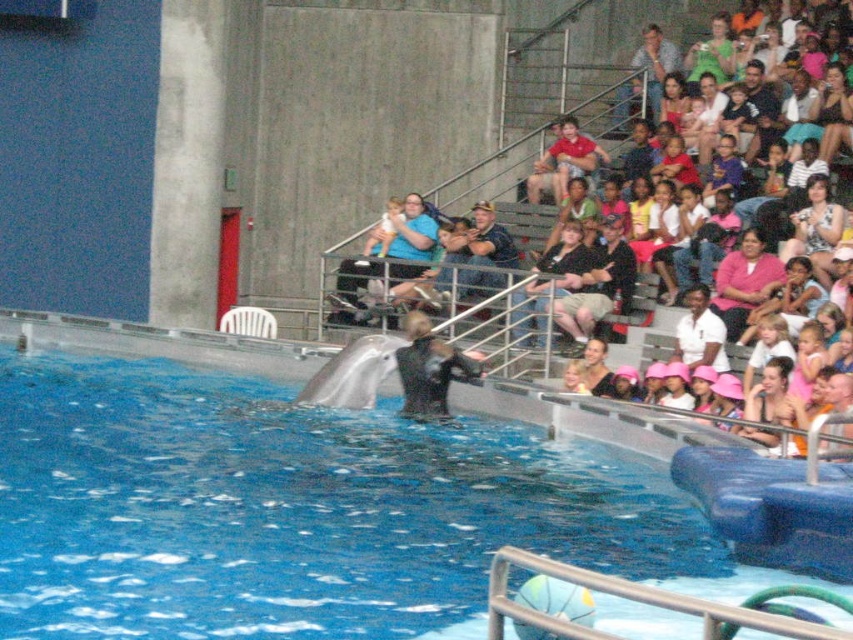
From the picture: Can you confirm if matte black dolphin at center is smaller than pink matte shirt at upper right?

No, matte black dolphin at center is not smaller than pink matte shirt at upper right.

Is matte black dolphin at center taller than pink matte shirt at upper right?

Correct, matte black dolphin at center is much taller as pink matte shirt at upper right.

Is point (601, 131) farther from viewer compared to point (747, 298)?

That is True.

Where is `matte black dolphin at center`? Image resolution: width=853 pixels, height=640 pixels. matte black dolphin at center is located at coordinates (605, 422).

Is blue rubber swimming pool at center below matte black dolphin at center?

Yes, blue rubber swimming pool at center is below matte black dolphin at center.

Is point (361, 428) more distant than point (660, 458)?

Yes, it is.

Does point (384, 472) come behind point (691, 422)?

Yes, point (384, 472) is farther from viewer.

The width and height of the screenshot is (853, 640). I want to click on blue rubber swimming pool at center, so click(294, 509).

Is white smooth dolphin at center above white cotton shirt at upper right?

Actually, white smooth dolphin at center is below white cotton shirt at upper right.

Who is positioned more to the left, white smooth dolphin at center or white cotton shirt at upper right?

white smooth dolphin at center is more to the left.

Which is in front, point (354, 392) or point (698, 339)?

Point (354, 392) is in front.

You are a GUI agent. You are given a task and a screenshot of the screen. Output one action in this format:
    pyautogui.click(x=<x>, y=<y>)
    Task: Click on the white smooth dolphin at center
    Image resolution: width=853 pixels, height=640 pixels.
    Given the screenshot: What is the action you would take?
    pyautogui.click(x=352, y=372)